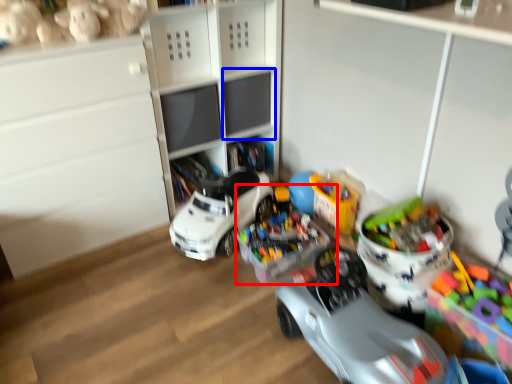
Question: Among these objects, which one is farthest to the camera, toy (highlighted by a red box) or shelf (highlighted by a blue box)?

Choices:
 (A) toy
 (B) shelf

Answer: (B)